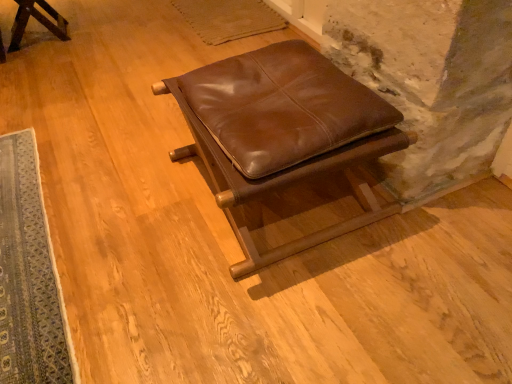
The height and width of the screenshot is (384, 512). In order to click on free point below blue woven rug at lower left (from a real-world perspective) in this screenshot , I will do `click(29, 233)`.